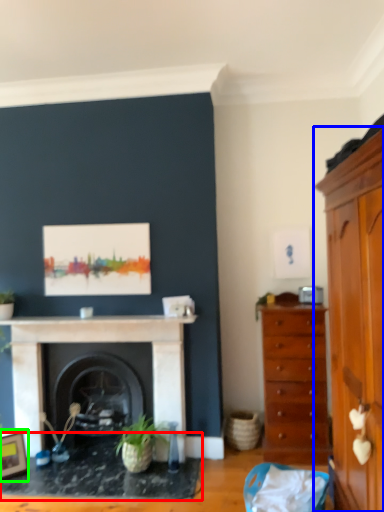
Question: Considering the real-world distances, which object is closest to table (highlighted by a red box)? cabinetry (highlighted by a blue box) or picture frame (highlighted by a green box).

Choices:
 (A) cabinetry
 (B) picture frame

Answer: (B)